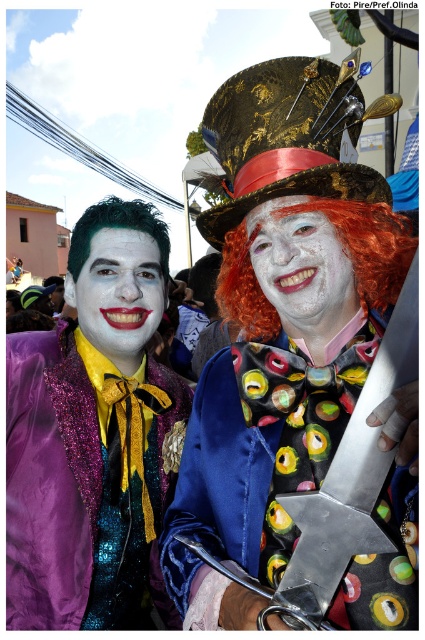
You are taking a photo of the two costumed individuals. You want to focus on the point at point (244,324) and point (260,260). Which point should you adjust your camera focus to first if you want to ensure both points are in focus?

Point (244,324) is further to the camera than point (260,260). To ensure both points are in focus, you should adjust your camera focus to the closer point first, which is point (260,260), and then adjust towards the further point.

From the picture: You are standing in front of the image and want to locate the sparkly purple jacket at left. What are the coordinates where it is positioned?

The sparkly purple jacket at left is positioned at coordinates point (40, 497).

You are an artist trying to sketch the scene. You notice the matte black face at center and the green shiny wig at left. Which object should you draw first if you want to start with the taller one?

The matte black face at center should be drawn first because it has a greater height compared to the green shiny wig at left.